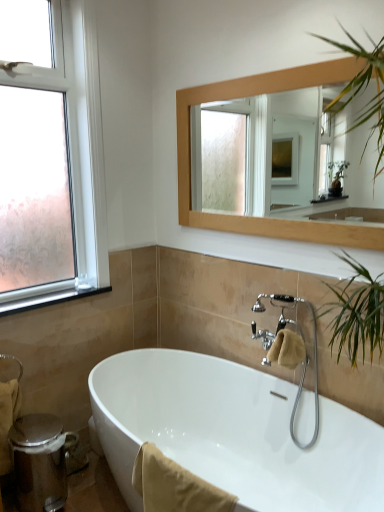
This screenshot has height=512, width=384. What do you see at coordinates (195, 157) in the screenshot?
I see `wooden frame mirror at upper center` at bounding box center [195, 157].

Measure the distance between beige cotton towel at lower center, the second bath towel from the left, and camera.

beige cotton towel at lower center, the second bath towel from the left, and camera are 4.82 feet apart.

I want to click on black rubber window sill at left, so click(47, 298).

At what (x,y) coordinates should I click in order to perform the action: click on chrome metallic faucet at upper right. Please return your answer as a coordinate pair (x, y). The image size is (384, 512). Looking at the image, I should click on (305, 356).

What is the approximate width of clear glass window at upper left?

clear glass window at upper left is 20.83 centimeters wide.

Locate an element on the screen. wooden frame mirror at upper center is located at coordinates (195, 157).

Identify the location of window behind the white glossy bathtub at center. (78, 128).

From a real-world perspective, is white glossy bathtub at center beneath clear glass window at upper left?

Yes, from a real-world perspective, white glossy bathtub at center is beneath clear glass window at upper left.

Based on the photo, from the image's perspective, between white glossy bathtub at center and clear glass window at upper left, which one is located above?

clear glass window at upper left appears higher in the image.

Is the depth of white glossy bathtub at center greater than that of clear glass window at upper left?

No, white glossy bathtub at center is closer to the camera.

From the image's perspective, which is below, beige cotton towel at lower center, the 3th bath towel in the back-to-front sequence, or chrome metallic faucet at upper right?

beige cotton towel at lower center, the 3th bath towel in the back-to-front sequence, is shown below in the image.

Considering the relative sizes of beige cotton towel at lower center, the 3th bath towel in the back-to-front sequence, and chrome metallic faucet at upper right in the image provided, is beige cotton towel at lower center, the 3th bath towel in the back-to-front sequence, shorter than chrome metallic faucet at upper right?

Indeed, beige cotton towel at lower center, the 3th bath towel in the back-to-front sequence, has a lesser height compared to chrome metallic faucet at upper right.

Which is more to the left, beige cotton towel at lower center, which is counted as the 2th bath towel, starting from the right, or chrome metallic faucet at upper right?

beige cotton towel at lower center, which is counted as the 2th bath towel, starting from the right.

Measure the distance from beige cotton towel at lower center, which is counted as the 2th bath towel, starting from the right, to chrome metallic faucet at upper right.

beige cotton towel at lower center, which is counted as the 2th bath towel, starting from the right, and chrome metallic faucet at upper right are 30.44 inches apart from each other.

Consider the image. Is clear glass window at upper left at the left side of black rubber window sill at left?

Yes, clear glass window at upper left is to the left of black rubber window sill at left.

From a real-world perspective, which object rests below the other?

From a 3D spatial view, black rubber window sill at left is below.

From the image's perspective, is clear glass window at upper left on black rubber window sill at left?

Correct, clear glass window at upper left appears higher than black rubber window sill at left in the image.

Identify the location of window sill below the clear glass window at upper left (from a real-world perspective). (47, 298).

Between point (317, 410) and point (286, 347), which one is positioned in front?

The point (286, 347) is more forward.

Considering the relative positions of chrome metallic faucet at upper right and beige fabric bath towel at center, acting as the first bath towel starting from the right, in the image provided, is chrome metallic faucet at upper right in front of beige fabric bath towel at center, acting as the first bath towel starting from the right,?

That is True.

Considering the relative sizes of chrome metallic faucet at upper right and beige fabric bath towel at center, positioned as the 3th bath towel in left-to-right order, in the image provided, is chrome metallic faucet at upper right smaller than beige fabric bath towel at center, positioned as the 3th bath towel in left-to-right order,?

No.

The image size is (384, 512). In the image, there is a chrome metallic faucet at upper right. Find the location of `bath towel above it (from the image's perspective)`. bath towel above it (from the image's perspective) is located at coordinates (287, 349).

Is black rubber window sill at left beside beige cotton towel at lower center, acting as the 1th bath towel starting from the front?

They are not placed beside each other.

Is black rubber window sill at left outside of beige cotton towel at lower center, the second bath towel from the left?

Absolutely, black rubber window sill at left is external to beige cotton towel at lower center, the second bath towel from the left.

At what (x,y) coordinates should I click in order to perform the action: click on window sill on the left of beige cotton towel at lower center, the 3th bath towel in the back-to-front sequence. Please return your answer as a coordinate pair (x, y). Looking at the image, I should click on (47, 298).

From the image's perspective, relative to beige cotton towel at lower center, acting as the 1th bath towel starting from the front, is black rubber window sill at left above or below?

Based on their image positions, black rubber window sill at left is located above beige cotton towel at lower center, acting as the 1th bath towel starting from the front.

Can you confirm if clear glass window at upper left is smaller than beige cotton towel at lower left, which ranks as the first bath towel in back-to-front order?

Incorrect, clear glass window at upper left is not smaller in size than beige cotton towel at lower left, which ranks as the first bath towel in back-to-front order.

Is clear glass window at upper left looking in the opposite direction of beige cotton towel at lower left, which ranks as the first bath towel in back-to-front order?

That's not correct — clear glass window at upper left is not looking away from beige cotton towel at lower left, which ranks as the first bath towel in back-to-front order.

From the image's perspective, relative to beige cotton towel at lower left, which is the third bath towel in front-to-back order, is clear glass window at upper left above or below?

clear glass window at upper left is above beige cotton towel at lower left, which is the third bath towel in front-to-back order.

From a real-world perspective, does beige cotton towel at lower center, acting as the 1th bath towel starting from the front, sit lower than clear glass window at upper left?

Yes.

Considering the sizes of beige cotton towel at lower center, which is counted as the 2th bath towel, starting from the right, and clear glass window at upper left in the image, is beige cotton towel at lower center, which is counted as the 2th bath towel, starting from the right, taller or shorter than clear glass window at upper left?

beige cotton towel at lower center, which is counted as the 2th bath towel, starting from the right, is shorter than clear glass window at upper left.

Is beige cotton towel at lower center, which is counted as the 2th bath towel, starting from the right, smaller than clear glass window at upper left?

Yes.

I want to click on bathtub below the clear glass window at upper left (from a real-world perspective), so click(233, 432).

Which bath towel is the 2nd one when counting from the left side of the chrome metallic faucet at upper right? Please provide its 2D coordinates.

[(174, 486)]

Based on the photo, when comparing their distances from black rubber window sill at left, does chrome metallic faucet at upper right or beige cotton towel at lower center, the 3th bath towel in the back-to-front sequence, seem closer?

beige cotton towel at lower center, the 3th bath towel in the back-to-front sequence.

Looking at this image, considering their positions, is chrome metallic faucet at upper right positioned further to wooden frame mirror at upper center than beige fabric bath towel at center, marked as the second bath towel in a front-to-back arrangement?

beige fabric bath towel at center, marked as the second bath towel in a front-to-back arrangement, is positioned further to the anchor wooden frame mirror at upper center.

Considering their positions, is wooden frame mirror at upper center positioned further to black rubber window sill at left than beige cotton towel at lower center, which is counted as the 2th bath towel, starting from the right?

beige cotton towel at lower center, which is counted as the 2th bath towel, starting from the right, is further to black rubber window sill at left.

When comparing their distances from beige cotton towel at lower left, placed as the 1th bath towel when sorted from left to right, does white glossy bathtub at center or black rubber window sill at left seem further?

Among the two, white glossy bathtub at center is located further to beige cotton towel at lower left, placed as the 1th bath towel when sorted from left to right.

When comparing their distances from beige fabric bath towel at center, acting as the first bath towel starting from the right, does beige cotton towel at lower left, the third bath towel when ordered from right to left, or wooden frame mirror at upper center seem closer?

wooden frame mirror at upper center is closer to beige fabric bath towel at center, acting as the first bath towel starting from the right.

Estimate the real-world distances between objects in this image. Which object is further from beige cotton towel at lower left, placed as the 1th bath towel when sorted from left to right, beige fabric bath towel at center, the 2th bath towel positioned from the back, or chrome metallic faucet at upper right?

Based on the image, chrome metallic faucet at upper right appears to be further to beige cotton towel at lower left, placed as the 1th bath towel when sorted from left to right.

From the image, which object appears to be nearer to clear glass window at upper left, black rubber window sill at left or white glossy bathtub at center?

black rubber window sill at left is positioned closer to the anchor clear glass window at upper left.

Based on their spatial positions, is chrome metallic faucet at upper right or beige fabric bath towel at center, positioned as the 3th bath towel in left-to-right order, closer to clear glass window at upper left?

chrome metallic faucet at upper right is positioned closer to the anchor clear glass window at upper left.

At what (x,y) coordinates should I click in order to perform the action: click on bath towel that lies between wooden frame mirror at upper center and chrome metallic faucet at upper right from top to bottom. Please return your answer as a coordinate pair (x, y). Image resolution: width=384 pixels, height=512 pixels. Looking at the image, I should click on (287, 349).

I want to click on window sill between beige cotton towel at lower left, which is the third bath towel in front-to-back order, and chrome metallic faucet at upper right from left to right, so click(47, 298).

The width and height of the screenshot is (384, 512). I want to click on tap between wooden frame mirror at upper center and beige cotton towel at lower center, the 3th bath towel in the back-to-front sequence, in the up-down direction, so click(x=305, y=356).

Where is `tap between clear glass window at upper left and beige cotton towel at lower center, which is counted as the 2th bath towel, starting from the right, in the up-down direction`? The width and height of the screenshot is (384, 512). tap between clear glass window at upper left and beige cotton towel at lower center, which is counted as the 2th bath towel, starting from the right, in the up-down direction is located at coordinates [x=305, y=356].